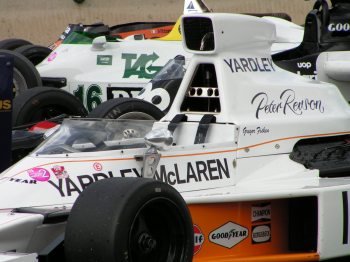
Where is `wall`? wall is located at coordinates (135, 6).